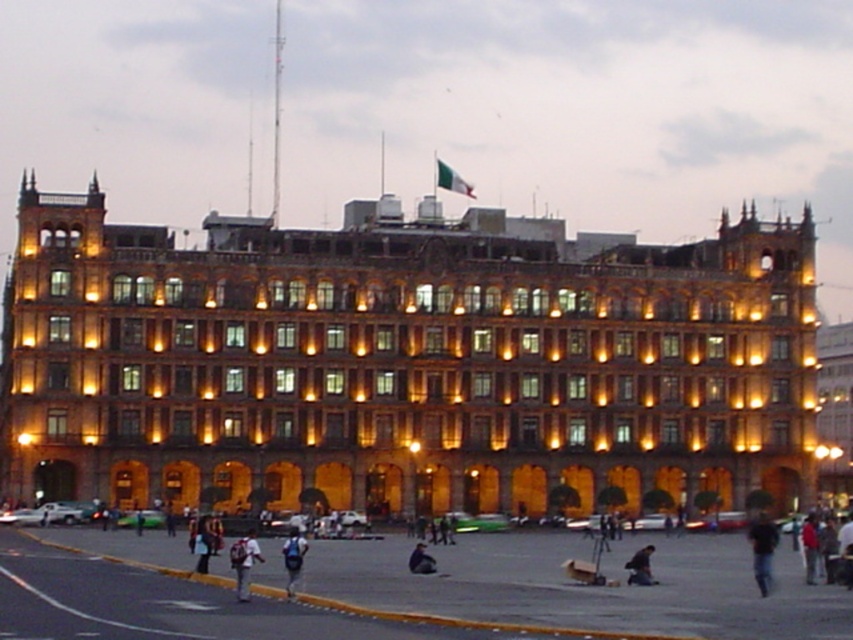
Question: Does white backpack at center appear on the left side of light blue backpack at center?

Choices:
 (A) yes
 (B) no

Answer: (A)

Question: Which point is farther to the camera?

Choices:
 (A) golden stone building at center
 (B) dark blue jeans at center
 (C) blue denim jeans at lower right

Answer: (A)

Question: Which point is farther to the camera?

Choices:
 (A) white backpack at center
 (B) blue denim jeans at lower right

Answer: (B)

Question: Which object is closer to the camera taking this photo?

Choices:
 (A) blue denim jeans at lower right
 (B) dark blue jeans at center
 (C) light blue backpack at center

Answer: (C)

Question: Is golden stone building at center below smooth asphalt road at lower left?

Choices:
 (A) no
 (B) yes

Answer: (A)

Question: Does smooth asphalt road at lower left have a lesser width compared to light blue backpack at center?

Choices:
 (A) yes
 (B) no

Answer: (B)